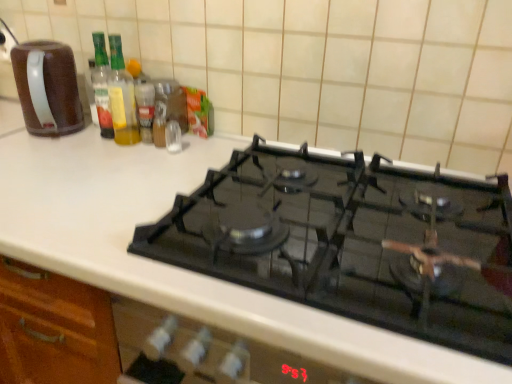
What do you see at coordinates (172, 101) in the screenshot? This screenshot has height=384, width=512. I see `metallic spice container at upper center` at bounding box center [172, 101].

The width and height of the screenshot is (512, 384). Identify the location of translucent glass spice at center, which is the 2th bottle from left to right. (145, 108).

In order to click on brown matte coffee pot at left in this screenshot , I will do pos(47,87).

From the image's perspective, relative to translucent glass bottle at upper left, arranged as the second bottle when viewed from the right, is brown matte coffee pot at left above or below?

From the image's perspective, brown matte coffee pot at left appears above translucent glass bottle at upper left, arranged as the second bottle when viewed from the right.

Consider the image. Would you say brown matte coffee pot at left is to the left or to the right of translucent glass bottle at upper left, arranged as the second bottle when viewed from the right, in the picture?

brown matte coffee pot at left is positioned on translucent glass bottle at upper left, arranged as the second bottle when viewed from the right,'s left side.

Between brown matte coffee pot at left and translucent glass bottle at upper left, arranged as the second bottle when viewed from the right, which one has smaller size?

translucent glass bottle at upper left, arranged as the second bottle when viewed from the right.

Can you confirm if brown matte coffee pot at left is positioned to the right of translucent glass spice at center, which is the 2th bottle from left to right?

No, brown matte coffee pot at left is not to the right of translucent glass spice at center, which is the 2th bottle from left to right.

Does brown matte coffee pot at left have a lesser height compared to translucent glass spice at center, the 1th bottle from the right?

Incorrect, the height of brown matte coffee pot at left does not fall short of that of translucent glass spice at center, the 1th bottle from the right.

You are a GUI agent. You are given a task and a screenshot of the screen. Output one action in this format:
    pyautogui.click(x=<x>, y=<y>)
    Task: Click on the kitchen appliance in front of the translucent glass spice at center, the 1th bottle from the right
    The height and width of the screenshot is (384, 512).
    Given the screenshot: What is the action you would take?
    pyautogui.click(x=47, y=87)

Is brown matte coffee pot at left not inside translucent glass spice at center, the 1th bottle from the right?

Yes.

In the scene shown: From the image's perspective, is metallic spice container at upper center on top of translucent glass spice at center, which is the 2th bottle from left to right?

Correct, metallic spice container at upper center appears higher than translucent glass spice at center, which is the 2th bottle from left to right, in the image.

Is metallic spice container at upper center to the left of translucent glass spice at center, the 1th bottle from the right, from the viewer's perspective?

No.

Could translucent glass spice at center, the 1th bottle from the right, be considered to be inside metallic spice container at upper center?

No, translucent glass spice at center, the 1th bottle from the right, is located outside of metallic spice container at upper center.

Considering the sizes of objects metallic spice container at upper center and translucent glass spice at center, the 1th bottle from the right, in the image provided, who is shorter, metallic spice container at upper center or translucent glass spice at center, the 1th bottle from the right,?

metallic spice container at upper center is shorter.

Are translucent glass spice at center, which is the 2th bottle from left to right, and metallic spice container at upper center making contact?

Absolutely, translucent glass spice at center, which is the 2th bottle from left to right, is next to and touching metallic spice container at upper center.

In terms of size, does translucent glass spice at center, the 1th bottle from the right, appear bigger or smaller than metallic spice container at upper center?

In the image, translucent glass spice at center, the 1th bottle from the right, appears to be smaller than metallic spice container at upper center.

Is point (152, 125) closer or farther from the camera than point (161, 92)?

Point (152, 125) is closer to the camera than point (161, 92).

How much distance is there between translucent glass spice at center, the 1th bottle from the right, and metallic spice container at upper center?

translucent glass spice at center, the 1th bottle from the right, and metallic spice container at upper center are 5.74 centimeters apart from each other.

This screenshot has width=512, height=384. I want to click on kitchen appliance that is above the translucent glass spice at center, which is the 2th bottle from left to right (from the image's perspective), so click(47, 87).

What's the angular difference between translucent glass spice at center, the 1th bottle from the right, and brown matte coffee pot at left's facing directions?

0.77 degrees separate the facing orientations of translucent glass spice at center, the 1th bottle from the right, and brown matte coffee pot at left.

Considering the relative sizes of translucent glass spice at center, the 1th bottle from the right, and brown matte coffee pot at left in the image provided, is translucent glass spice at center, the 1th bottle from the right, smaller than brown matte coffee pot at left?

Yes, translucent glass spice at center, the 1th bottle from the right, is smaller than brown matte coffee pot at left.

Could you tell me if translucent glass spice at center, the 1th bottle from the right, is facing brown matte coffee pot at left?

No, translucent glass spice at center, the 1th bottle from the right, is not aimed at brown matte coffee pot at left.

Is the position of translucent glass bottle at upper left, arranged as the second bottle when viewed from the right, more distant than that of metallic spice container at upper center?

No, the depth of translucent glass bottle at upper left, arranged as the second bottle when viewed from the right, is less than that of metallic spice container at upper center.

From a real-world perspective, is translucent glass bottle at upper left, arranged as the second bottle when viewed from the right, below metallic spice container at upper center?

No.

Which point is more distant from viewer, (116, 96) or (169, 117)?

The point (169, 117) is farther.

Which object is further away from the camera, brown matte coffee pot at left or metallic spice container at upper center?

metallic spice container at upper center is more distant.

From the picture: Can you confirm if brown matte coffee pot at left is wider than metallic spice container at upper center?

Indeed, brown matte coffee pot at left has a greater width compared to metallic spice container at upper center.

Is point (35, 103) positioned before point (179, 86)?

Yes, it is.

Image resolution: width=512 pixels, height=384 pixels. I want to click on the 1st bottle below when counting from the brown matte coffee pot at left (from the image's perspective), so click(122, 97).

Where is `kitchen appliance that is on the left side of translucent glass spice at center, the 1th bottle from the right`? This screenshot has width=512, height=384. kitchen appliance that is on the left side of translucent glass spice at center, the 1th bottle from the right is located at coordinates (47, 87).

Which object lies further to the anchor point brown matte coffee pot at left, translucent glass bottle at upper left, arranged as the second bottle when viewed from the right, or translucent glass spice at center, the 1th bottle from the right?

translucent glass spice at center, the 1th bottle from the right, is positioned further to the anchor brown matte coffee pot at left.

Estimate the real-world distances between objects in this image. Which object is closer to metallic spice container at upper center, translucent glass spice at center, the 1th bottle from the right, or translucent glass bottle at upper left, which ranks as the first bottle in left-to-right order?

translucent glass spice at center, the 1th bottle from the right, lies closer to metallic spice container at upper center than the other object.

Which object lies further to the anchor point brown matte coffee pot at left, translucent glass spice at center, the 1th bottle from the right, or metallic spice container at upper center?

metallic spice container at upper center.

Based on their spatial positions, is metallic spice container at upper center or translucent glass bottle at upper left, which ranks as the first bottle in left-to-right order, further from brown matte coffee pot at left?

The object further to brown matte coffee pot at left is metallic spice container at upper center.

Looking at the image, which one is located further to translucent glass bottle at upper left, arranged as the second bottle when viewed from the right, brown matte coffee pot at left or translucent glass spice at center, the 1th bottle from the right?

Among the two, brown matte coffee pot at left is located further to translucent glass bottle at upper left, arranged as the second bottle when viewed from the right.

When comparing their distances from translucent glass spice at center, the 1th bottle from the right, does translucent glass bottle at upper left, arranged as the second bottle when viewed from the right, or metallic spice container at upper center seem closer?

translucent glass bottle at upper left, arranged as the second bottle when viewed from the right, is positioned closer to the anchor translucent glass spice at center, the 1th bottle from the right.

From the image, which object appears to be nearer to translucent glass spice at center, which is the 2th bottle from left to right, brown matte coffee pot at left or translucent glass bottle at upper left, arranged as the second bottle when viewed from the right?

translucent glass bottle at upper left, arranged as the second bottle when viewed from the right, is closer to translucent glass spice at center, which is the 2th bottle from left to right.

In the scene shown: From the image, which object appears to be nearer to translucent glass spice at center, the 1th bottle from the right, brown matte coffee pot at left or metallic spice container at upper center?

metallic spice container at upper center is closer to translucent glass spice at center, the 1th bottle from the right.

Locate an element on the screen. The width and height of the screenshot is (512, 384). bottle situated between brown matte coffee pot at left and translucent glass spice at center, the 1th bottle from the right, from left to right is located at coordinates (122, 97).

At what (x,y) coordinates should I click in order to perform the action: click on bottle between translucent glass bottle at upper left, which ranks as the first bottle in left-to-right order, and metallic spice container at upper center from front to back. Please return your answer as a coordinate pair (x, y). This screenshot has width=512, height=384. Looking at the image, I should click on (145, 108).